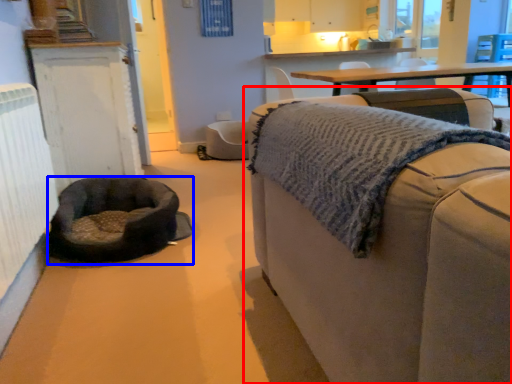
Question: Which point is further to the camera, studio couch (highlighted by a red box) or dog bed (highlighted by a blue box)?

Choices:
 (A) studio couch
 (B) dog bed

Answer: (B)